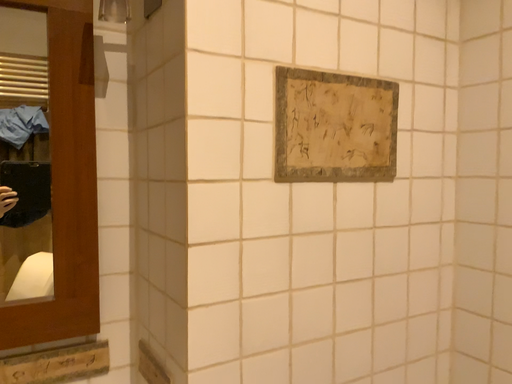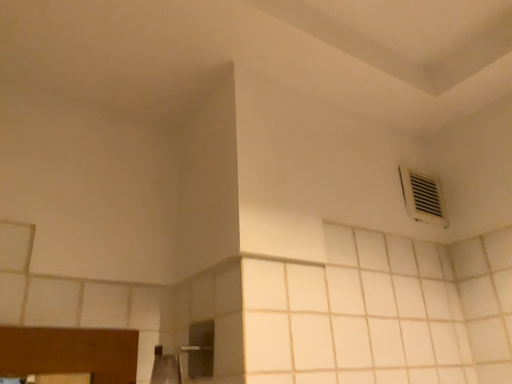
Question: How did the camera likely rotate when shooting the video?

Choices:
 (A) rotated upward
 (B) rotated downward

Answer: (A)